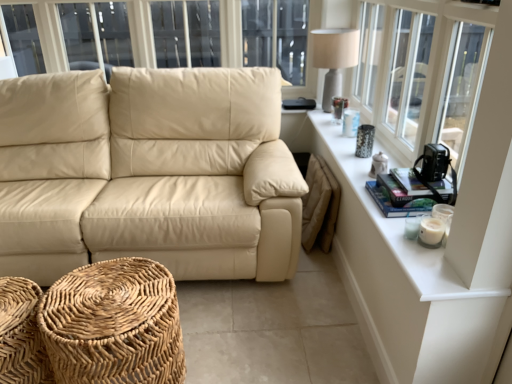
Question: Considering the relative sizes of woven natural fiber footrest at lower left, the 2th footrest from the left, and white ceramic table at upper right in the image provided, is woven natural fiber footrest at lower left, the 2th footrest from the left, taller than white ceramic table at upper right?

Choices:
 (A) no
 (B) yes

Answer: (B)

Question: From the image's perspective, does woven natural fiber footrest at lower left, the 2th footrest from the left, appear higher than white ceramic table at upper right?

Choices:
 (A) yes
 (B) no

Answer: (B)

Question: Considering the relative positions of woven natural fiber footrest at lower left, arranged as the first footrest when viewed from the right, and white ceramic table at upper right in the image provided, is woven natural fiber footrest at lower left, arranged as the first footrest when viewed from the right, in front of white ceramic table at upper right?

Choices:
 (A) yes
 (B) no

Answer: (B)

Question: From the image's perspective, is woven natural fiber footrest at lower left, arranged as the first footrest when viewed from the right, located beneath white ceramic table at upper right?

Choices:
 (A) no
 (B) yes

Answer: (B)

Question: Is woven natural fiber footrest at lower left, the 2th footrest from the left, surrounding white ceramic table at upper right?

Choices:
 (A) no
 (B) yes

Answer: (A)

Question: Considering the positions of woven wood footrest at lower left, marked as the second footrest in a right-to-left arrangement, and beige leather couch at center in the image, is woven wood footrest at lower left, marked as the second footrest in a right-to-left arrangement, bigger or smaller than beige leather couch at center?

Choices:
 (A) big
 (B) small

Answer: (B)

Question: Is woven wood footrest at lower left, marked as the second footrest in a right-to-left arrangement, wider or thinner than beige leather couch at center?

Choices:
 (A) thin
 (B) wide

Answer: (A)

Question: From their relative heights in the image, would you say woven wood footrest at lower left, positioned as the first footrest in left-to-right order, is taller or shorter than beige leather couch at center?

Choices:
 (A) short
 (B) tall

Answer: (A)

Question: From the image's perspective, relative to beige leather couch at center, is woven wood footrest at lower left, marked as the second footrest in a right-to-left arrangement, above or below?

Choices:
 (A) above
 (B) below

Answer: (B)

Question: In terms of height, does white textured windowsill at upper right look taller or shorter compared to woven wood footrest at lower left, marked as the second footrest in a right-to-left arrangement?

Choices:
 (A) short
 (B) tall

Answer: (B)

Question: Is white textured windowsill at upper right inside the boundaries of woven wood footrest at lower left, marked as the second footrest in a right-to-left arrangement, or outside?

Choices:
 (A) inside
 (B) outside

Answer: (B)

Question: Does point (360, 38) appear closer or farther from the camera than point (42, 369)?

Choices:
 (A) closer
 (B) farther

Answer: (B)

Question: Is white textured windowsill at upper right in front of or behind woven wood footrest at lower left, marked as the second footrest in a right-to-left arrangement, in the image?

Choices:
 (A) behind
 (B) front

Answer: (B)

Question: In the image, is woven wood footrest at lower left, positioned as the first footrest in left-to-right order, positioned in front of or behind white ceramic table at upper right?

Choices:
 (A) behind
 (B) front

Answer: (A)

Question: Is woven wood footrest at lower left, positioned as the first footrest in left-to-right order, wider or thinner than white ceramic table at upper right?

Choices:
 (A) wide
 (B) thin

Answer: (A)